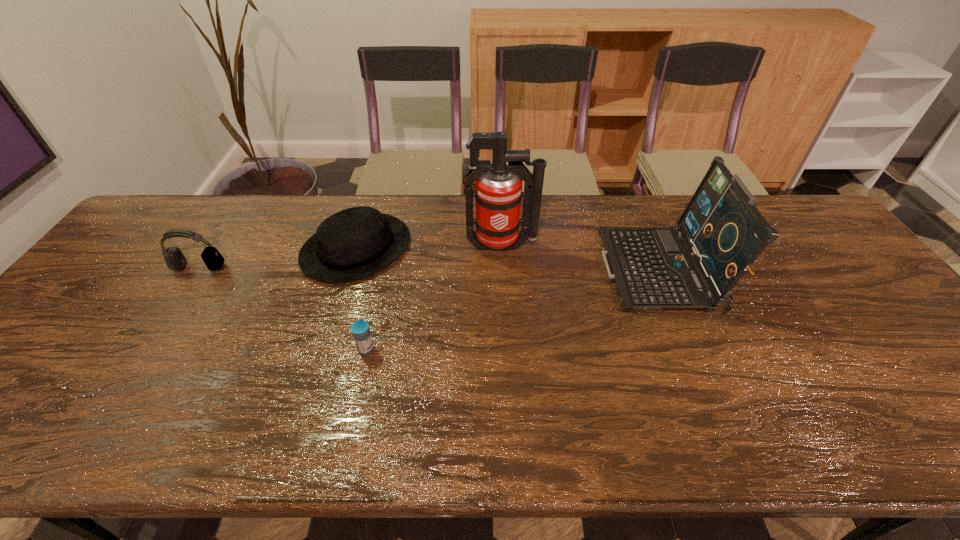
Where is `the fourth object from left to right`? This screenshot has height=540, width=960. the fourth object from left to right is located at coordinates (498, 187).

Locate an element on the screen. This screenshot has width=960, height=540. fire extinguisher is located at coordinates (498, 187).

I want to click on the second tallest object, so click(724, 232).

You are a GUI agent. You are given a task and a screenshot of the screen. Output one action in this format:
    pyautogui.click(x=<x>, y=<y>)
    Task: Click on the laptop computer
    
    Given the screenshot: What is the action you would take?
    pyautogui.click(x=724, y=232)

Image resolution: width=960 pixels, height=540 pixels. What are the coordinates of `the third shortest object` in the screenshot? It's located at (173, 256).

Where is `headset`? The image size is (960, 540). headset is located at coordinates (173, 256).

Identify the location of the fourth tallest object. Image resolution: width=960 pixels, height=540 pixels. (356, 242).

This screenshot has height=540, width=960. What are the coordinates of `the nearest object` in the screenshot? It's located at (360, 329).

This screenshot has height=540, width=960. I want to click on the shortest object, so click(360, 329).

Locate an element on the screen. The height and width of the screenshot is (540, 960). vacant space located on the front label side of the fire extinguisher is located at coordinates (506, 329).